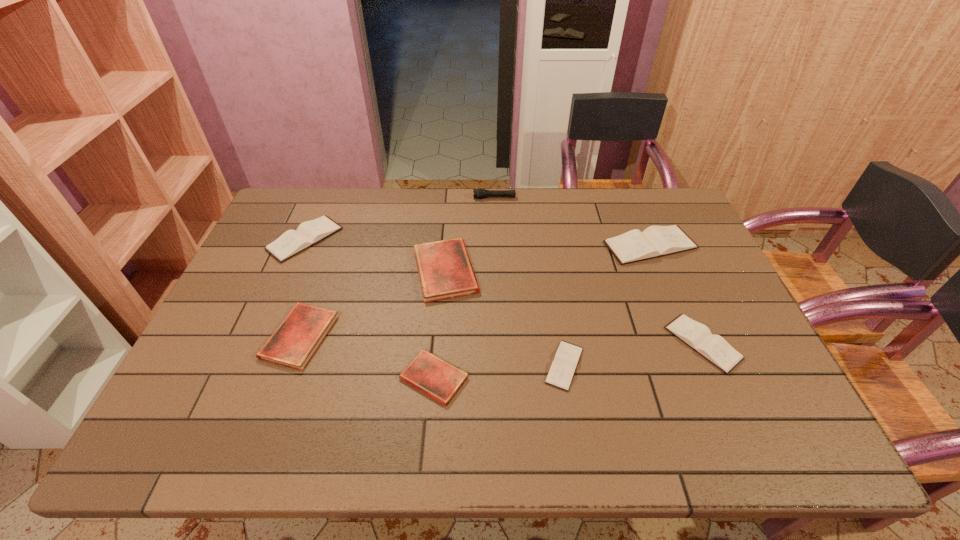
The width and height of the screenshot is (960, 540). Identify the location of empty location between the leftmost brown diary and the second smallest brown diary. (504, 291).

The image size is (960, 540). I want to click on free space that is in between the second smallest brown diary and the farthest object, so click(x=598, y=271).

The width and height of the screenshot is (960, 540). Find the location of `free space between the smallest red diary and the leftmost brown diary`. free space between the smallest red diary and the leftmost brown diary is located at coordinates (370, 308).

The image size is (960, 540). Identify the location of free space between the smallest red diary and the biggest red diary. point(440,325).

This screenshot has width=960, height=540. In order to click on free area in between the farthest object and the third biggest brown diary in this screenshot , I will do `click(598, 271)`.

Where is `free area in between the biggest brown diary and the smallest red diary`? The width and height of the screenshot is (960, 540). free area in between the biggest brown diary and the smallest red diary is located at coordinates (542, 312).

Identify the location of free space between the smallest red diary and the sixth object from left to right. The height and width of the screenshot is (540, 960). (499, 372).

You are a GUI agent. You are given a task and a screenshot of the screen. Output one action in this format:
    pyautogui.click(x=<x>, y=<y>)
    Task: Click on the vacant area that lies between the leftmost red diary and the second brown diary from left to right
    The height and width of the screenshot is (540, 960).
    Given the screenshot: What is the action you would take?
    pyautogui.click(x=432, y=351)

In order to click on object that is the seventh closest to the biggest brown diary in this screenshot , I will do click(x=292, y=242).

You are a GUI agent. You are given a task and a screenshot of the screen. Output one action in this format:
    pyautogui.click(x=<x>, y=<y>)
    Task: Click on the sixth closest object to the second smallest red diary
    The image size is (960, 540).
    Given the screenshot: What is the action you would take?
    pyautogui.click(x=655, y=241)